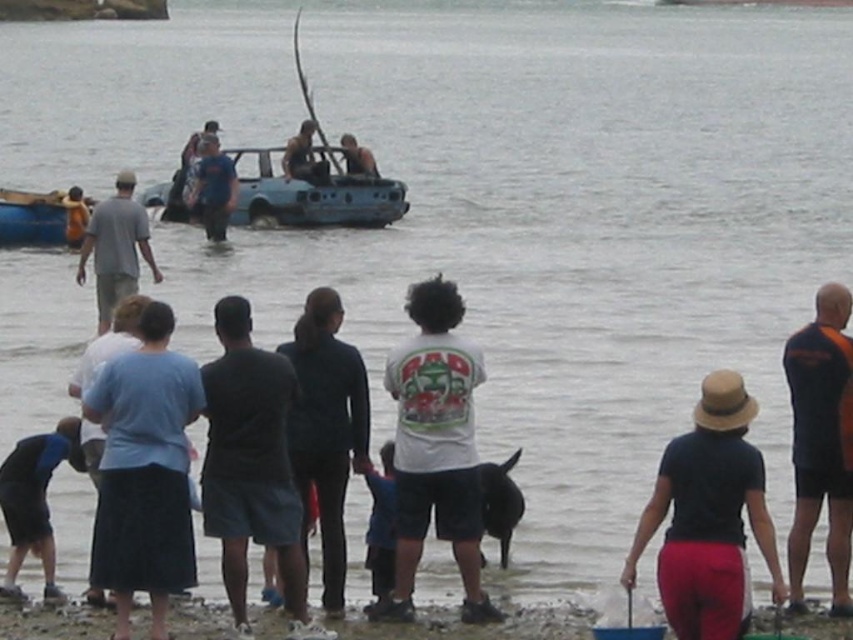
From the picture: Between matte brown hat at center and blue fabric shirt at center, which one appears on the right side from the viewer's perspective?

matte brown hat at center is more to the right.

Where is `matte brown hat at center`? matte brown hat at center is located at coordinates (709, 516).

Where is `matte brown hat at center`? This screenshot has height=640, width=853. matte brown hat at center is located at coordinates (709, 516).

Measure the distance between matte brown hat at center and gray cotton shirt at center.

matte brown hat at center is 20.11 meters away from gray cotton shirt at center.

You are a GUI agent. You are given a task and a screenshot of the screen. Output one action in this format:
    pyautogui.click(x=<x>, y=<y>)
    Task: Click on the matte brown hat at center
    
    Given the screenshot: What is the action you would take?
    pyautogui.click(x=709, y=516)

The width and height of the screenshot is (853, 640). Identify the location of matte brown hat at center. (709, 516).

The width and height of the screenshot is (853, 640). Identify the location of matte brown hat at center. (709, 516).

Is dark gray shorts at center to the left of shiny metallic car at center from the viewer's perspective?

In fact, dark gray shorts at center is to the right of shiny metallic car at center.

Which is above, dark gray shorts at center or shiny metallic car at center?

Positioned higher is shiny metallic car at center.

Which is behind, point (229, 492) or point (357, 157)?

The point (357, 157) is more distant.

Locate an element on the screen. dark gray shorts at center is located at coordinates (251, 465).